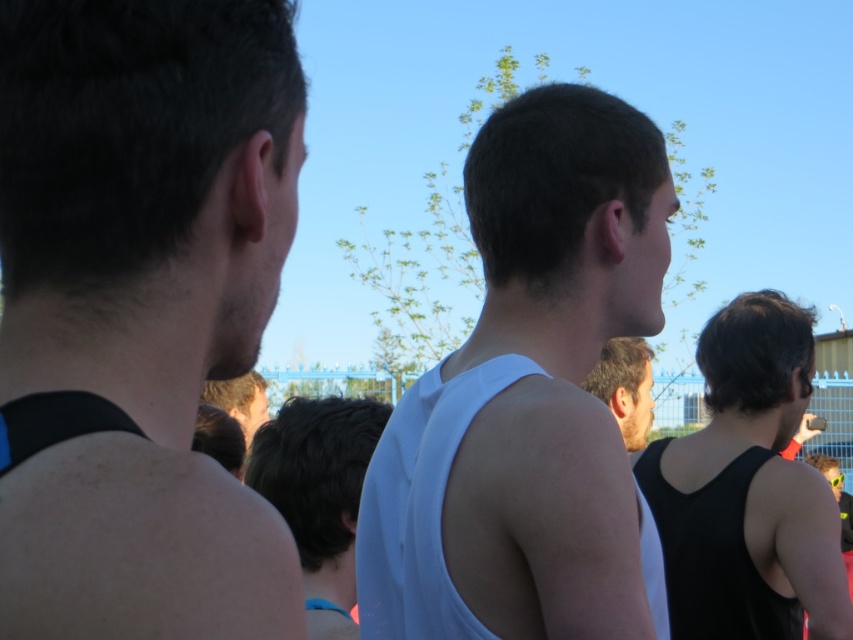
You are a photographer trying to capture a photo of the black matte tank top at left and the white matte tank top at center. Based on their positions, which one would appear larger in your photo?

The black matte tank top at left appears larger because it is closer to the viewer than the white matte tank top at center.

You are standing at the front of the scene and want to hand a flyer to both the person wearing the white matte tank top at center and the person wearing the black matte tank top at right. Which person should you approach first based on their position?

You should approach the person wearing the white matte tank top at center first because they are closer to you than the black matte tank top at right, which is further away.